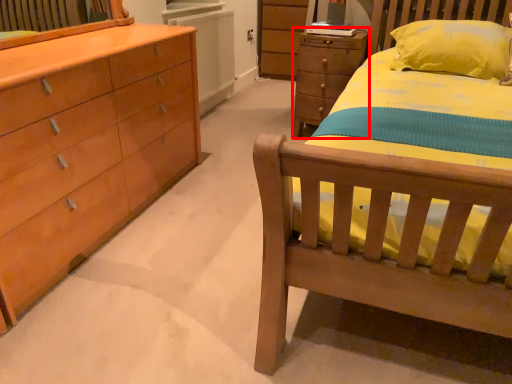
Question: Considering the relative positions of chest of drawers (annotated by the red box) and radiator in the image provided, where is chest of drawers (annotated by the red box) located with respect to the staircase?

Choices:
 (A) right
 (B) left

Answer: (A)